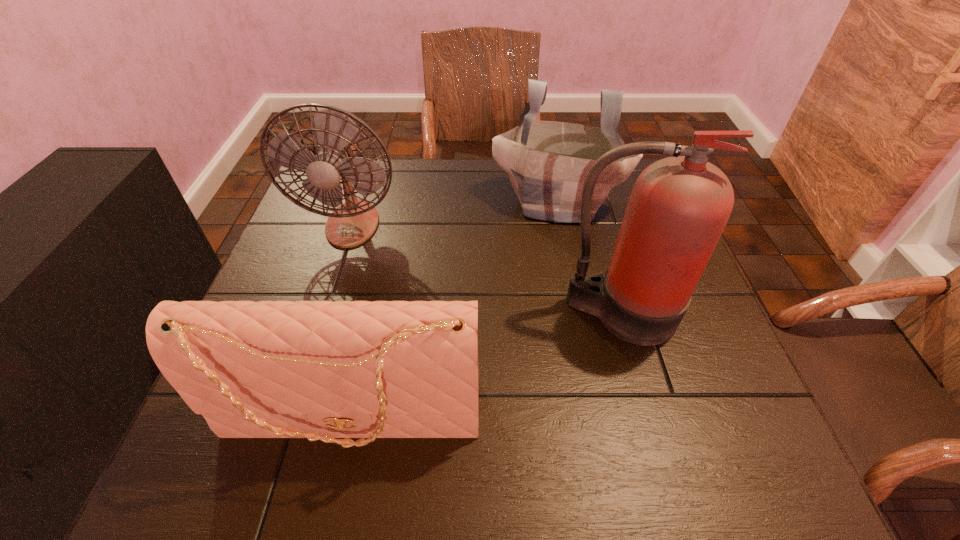
Where is `vacant region between the fan and the shopping bag`? This screenshot has height=540, width=960. vacant region between the fan and the shopping bag is located at coordinates (455, 213).

This screenshot has width=960, height=540. I want to click on object that is the second closest to the fan, so click(x=321, y=370).

Choose which object is the third nearest neighbor to the fan. Please provide its 2D coordinates. Your answer should be formatted as a tuple, i.e. [(x, y)], where the tuple contains the x and y coordinates of a point satisfying the conditions above.

[(679, 206)]